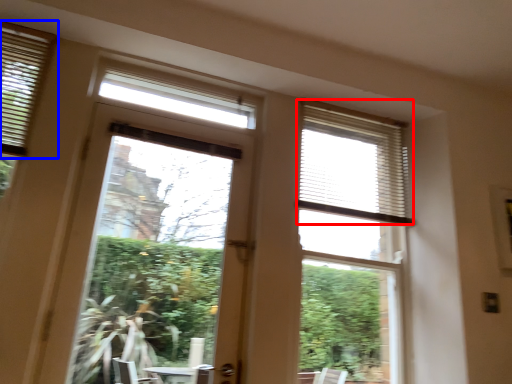
Question: Which object appears closest to the camera in this image, blind (highlighted by a red box) or window blind (highlighted by a blue box)?

Choices:
 (A) blind
 (B) window blind

Answer: (B)